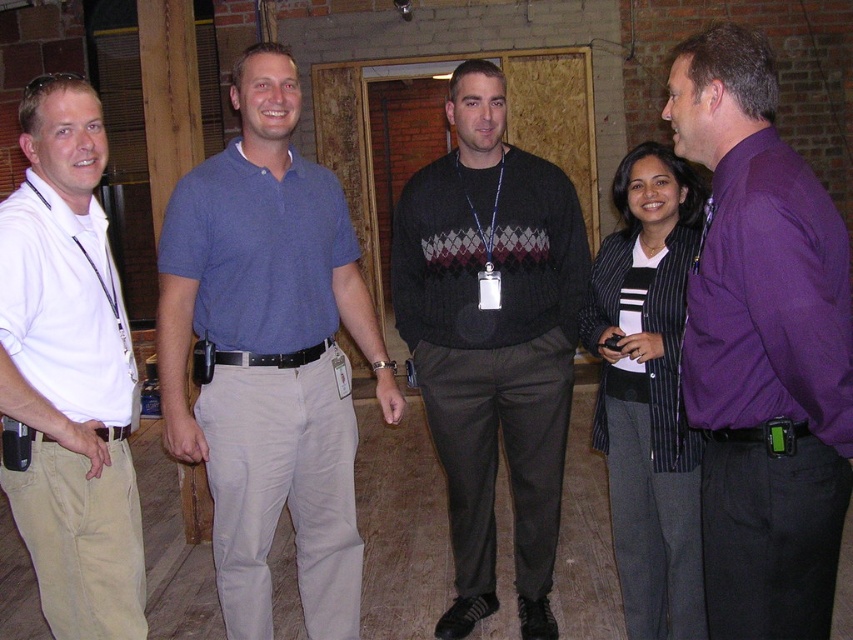
Question: Which point appears closest to the camera in this image?

Choices:
 (A) (28, 186)
 (B) (199, 262)
 (C) (653, 534)
 (D) (448, 490)

Answer: (A)

Question: Is purple shirt at right to the left of striped blazer at center from the viewer's perspective?

Choices:
 (A) no
 (B) yes

Answer: (A)

Question: Can you confirm if dark gray sweater at center is smaller than striped blazer at center?

Choices:
 (A) yes
 (B) no

Answer: (B)

Question: Among these objects, which one is nearest to the camera?

Choices:
 (A) blue cotton polo shirt at center
 (B) purple shirt at right
 (C) dark gray sweater at center
 (D) white cotton shirt at left

Answer: (B)

Question: Can you confirm if blue cotton polo shirt at center is positioned below purple shirt at right?

Choices:
 (A) yes
 (B) no

Answer: (A)

Question: Which object appears closest to the camera in this image?

Choices:
 (A) purple shirt at right
 (B) striped blazer at center
 (C) dark gray sweater at center
 (D) white cotton shirt at left

Answer: (A)